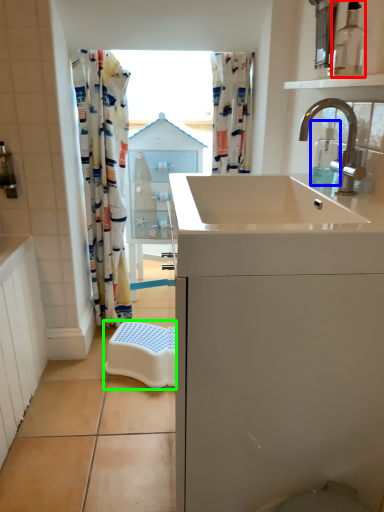
Question: Estimate the real-world distances between objects in this image. Which object is closer to bottle (highlighted by a red box), soap dispenser (highlighted by a blue box) or stool (highlighted by a green box)?

Choices:
 (A) soap dispenser
 (B) stool

Answer: (A)